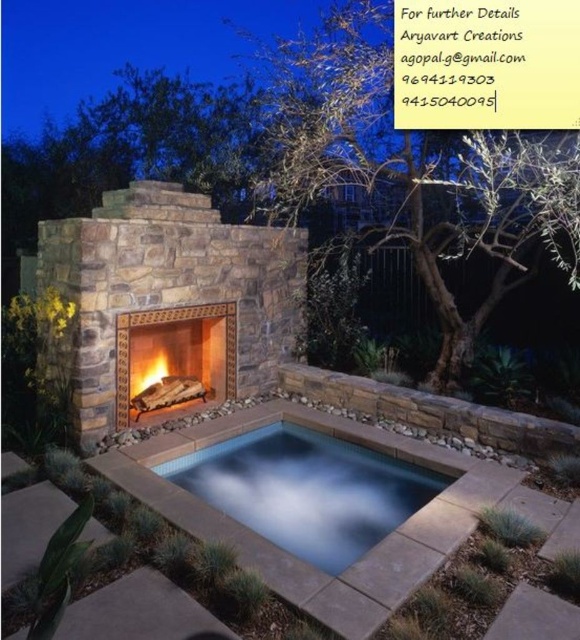
You are standing in front of the scene and want to place a decorative statue. The statue needs to be placed above the clear glass pool at center but must not be placed on the matte stone fireplace at center. Where can you place the statue?

The statue can be placed above the clear glass pool at center but not on the matte stone fireplace at center. Since the clear glass pool at center is located below the matte stone fireplace at center, placing the statue above the pool would mean positioning it between the pool and the fireplace, ensuring it doesn

You are standing in the outdoor area and want to place a tall decorative statue that is 1.8 meters in height. Considering the clear glass pool at center and the matte stone fireplace at center, which object is tall enough to support the statue without it toppling over?

The matte stone fireplace at center is taller than the clear glass pool at center, so the statue can be placed on the matte stone fireplace at center safely.

You are standing in front of the fireplace and want to step onto the clear glass pool at center. Is the pool in front of or behind the matte stone fireplace at center?

The clear glass pool at center is closer to the viewer than the matte stone fireplace at center, so the pool is in front of the fireplace.